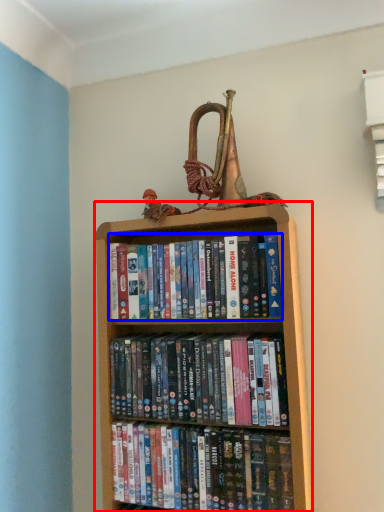
Question: Which object appears farthest to the camera in this image, bookcase (highlighted by a red box) or book (highlighted by a blue box)?

Choices:
 (A) bookcase
 (B) book

Answer: (B)